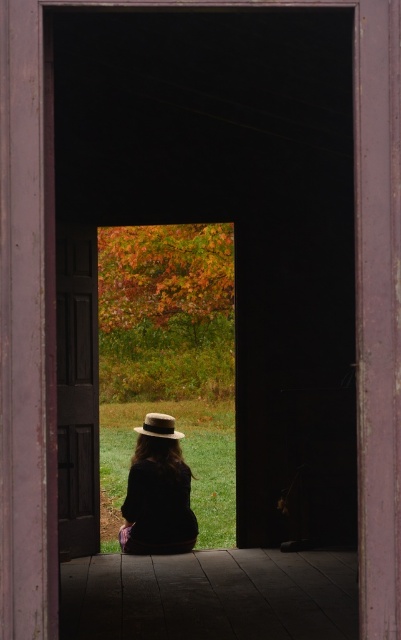
Can you confirm if matte black coat at center is positioned to the left of brown felt fedora at center?

Indeed, matte black coat at center is positioned on the left side of brown felt fedora at center.

Which is in front, point (176, 532) or point (170, 416)?

Point (176, 532) is more forward.

What do you see at coordinates (157, 492) in the screenshot?
I see `matte black coat at center` at bounding box center [157, 492].

At what (x,y) coordinates should I click in order to perform the action: click on matte black coat at center. Please return your answer as a coordinate pair (x, y). The width and height of the screenshot is (401, 640). Looking at the image, I should click on click(x=157, y=492).

Is dark wood door at center to the right of brown felt fedora at center from the viewer's perspective?

In fact, dark wood door at center is to the left of brown felt fedora at center.

Is dark wood door at center shorter than brown felt fedora at center?

In fact, dark wood door at center may be taller than brown felt fedora at center.

You are a GUI agent. You are given a task and a screenshot of the screen. Output one action in this format:
    pyautogui.click(x=<x>, y=<y>)
    Task: Click on the dark wood door at center
    The height and width of the screenshot is (640, 401).
    Given the screenshot: What is the action you would take?
    pyautogui.click(x=76, y=390)

Which is in front, point (74, 340) or point (176, 525)?

Point (176, 525)

Which of these two, dark wood door at center or matte black coat at center, stands taller?

With more height is dark wood door at center.

Find the location of a particular element. The image size is (401, 640). dark wood door at center is located at coordinates (76, 390).